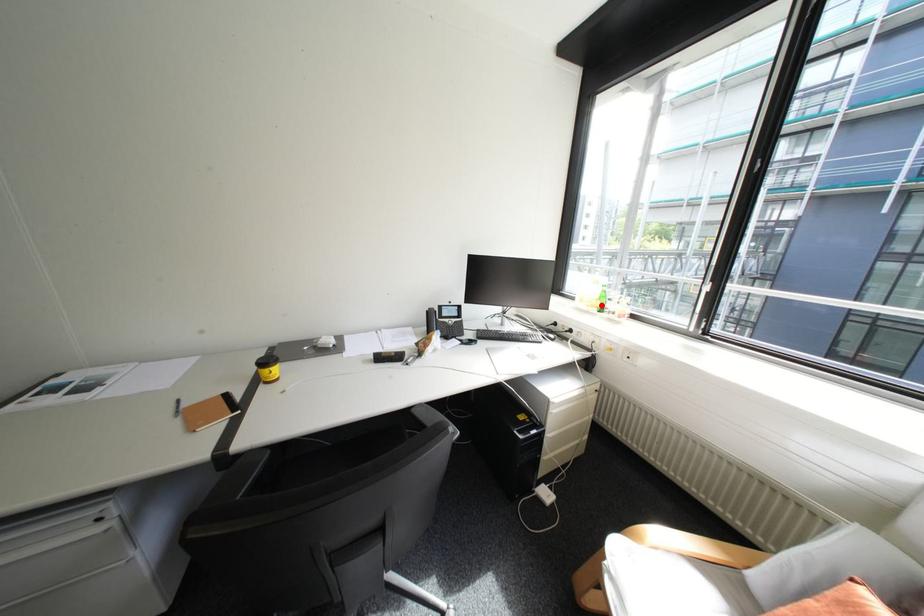
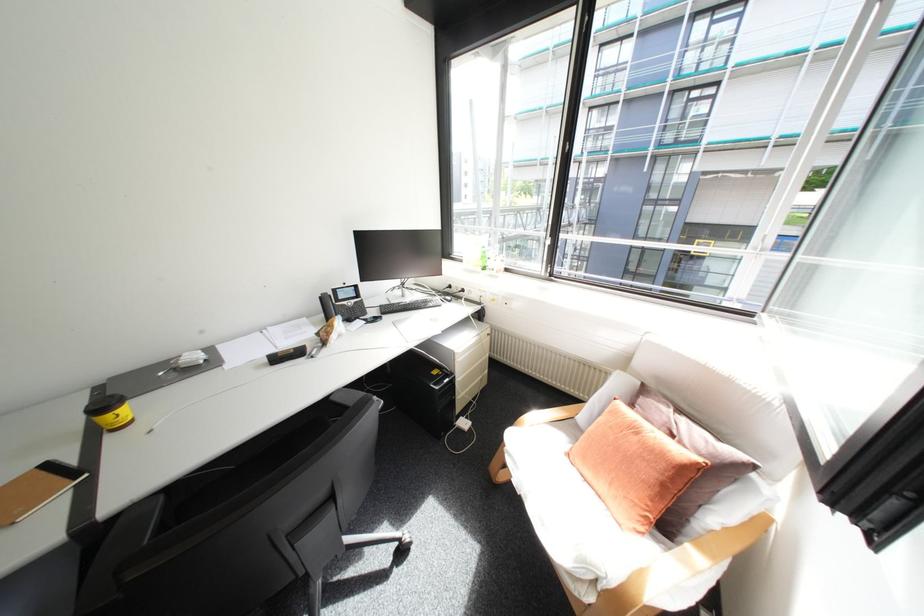
The point at the highlighted location is marked in the first image. Where is the corresponding point in the second image?

(487, 265)